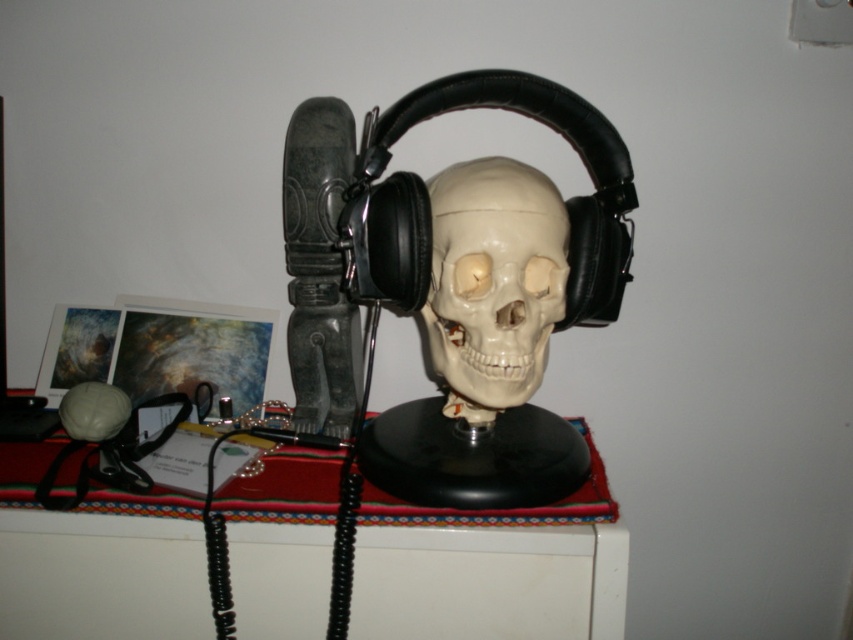
Is point (375, 508) more distant than point (453, 326)?

That is False.

Is white glossy table at center thinner than white matte skull at center?

No.

Does point (91, 582) come closer to viewer compared to point (532, 244)?

Yes, point (91, 582) is in front of point (532, 244).

You are a GUI agent. You are given a task and a screenshot of the screen. Output one action in this format:
    pyautogui.click(x=<x>, y=<y>)
    Task: Click on the white glossy table at center
    The width and height of the screenshot is (853, 640).
    Given the screenshot: What is the action you would take?
    pyautogui.click(x=490, y=580)